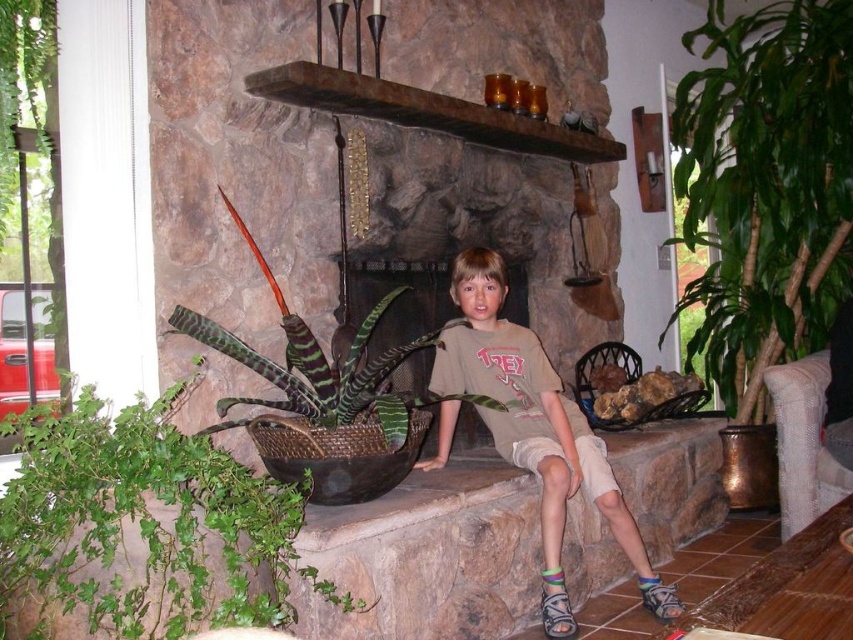
Is green leafy plant at right closer to camera compared to brown stone ledge at center?

No, it is not.

Is point (686, 92) positioned in front of point (699, 442)?

That is False.

The width and height of the screenshot is (853, 640). In order to click on green leafy plant at right in this screenshot , I will do `click(764, 184)`.

Between point (65, 625) and point (268, 369), which one is positioned behind?

The point (268, 369) is more distant.

Which is more to the left, brown stone ledge at center or green striped leaves at center?

From the viewer's perspective, green striped leaves at center appears more on the left side.

What do you see at coordinates (428, 556) in the screenshot? Image resolution: width=853 pixels, height=640 pixels. I see `brown stone ledge at center` at bounding box center [428, 556].

The height and width of the screenshot is (640, 853). Identify the location of brown stone ledge at center. (428, 556).

Who is lower down, green striped leaves at center or rustic wood mantle at upper center?

green striped leaves at center is below.

Is green striped leaves at center above rustic wood mantle at upper center?

Actually, green striped leaves at center is below rustic wood mantle at upper center.

Identify the location of green striped leaves at center. (323, 365).